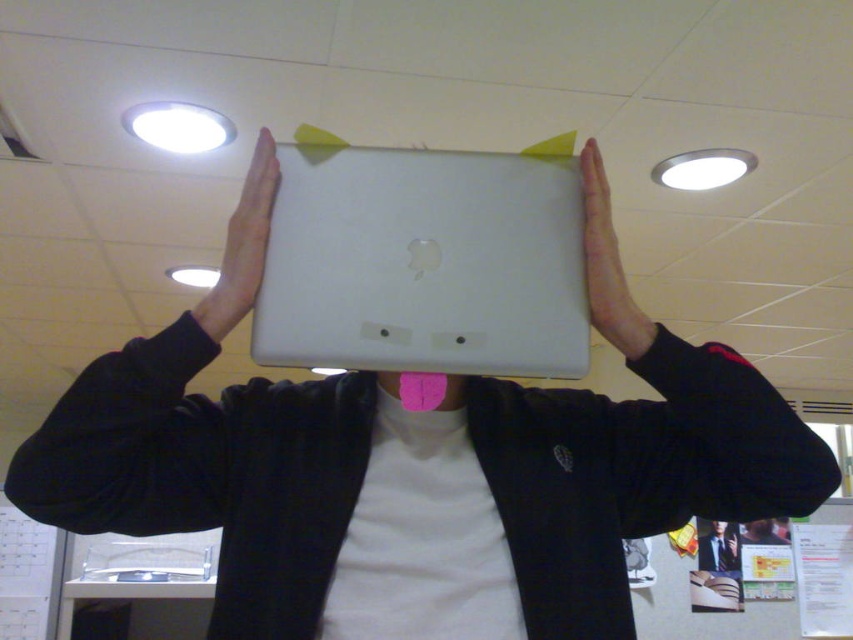
You are organizing a tech fair and need to arrange two laptops on a display table. The laptops are labeled as the satin white laptop at center and the white matte laptop at center. According to the image, which laptop should be placed to the left to maintain the correct spatial arrangement?

The white matte laptop at center should be placed to the left since the satin white laptop at center is to its right in the image.

In the scene shown: You are a delivery person who needs to hand over a package to the person holding the satin white laptop at center. The package is 24 inches long. Can you safely hand over the package without it touching the laptop?

The satin white laptop at center is 25.58 inches away from the viewer. Since the package is 24 inches long, it can be handed over safely as the distance is sufficient to avoid contact with the laptop.